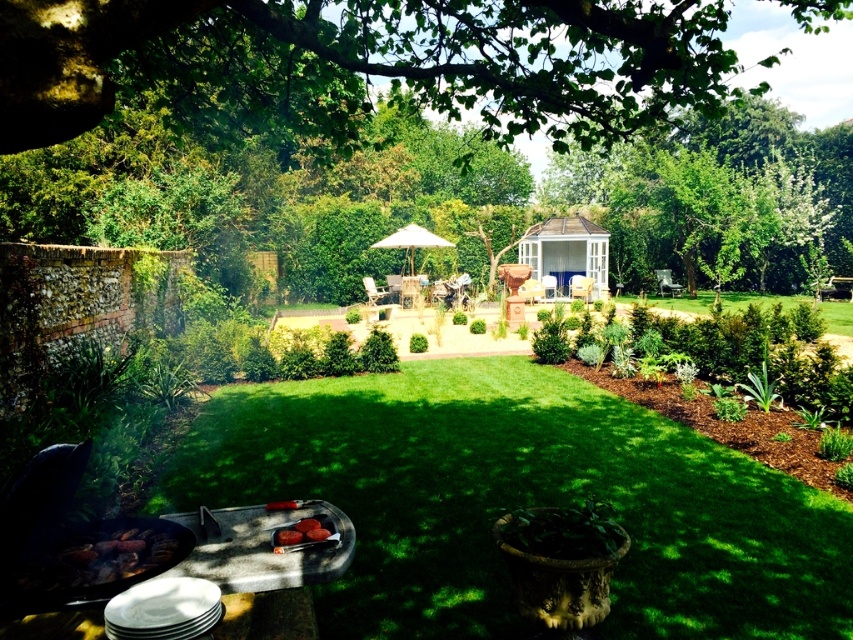
Question: Estimate the real-world distances between objects in this image. Which object is farther from the white wooden gazebo at center?

Choices:
 (A) charcoal briquettes at lower left
 (B) smooth red tomato at lower center

Answer: (A)

Question: Is smooth metal grill at lower left closer to the viewer compared to white fabric umbrella at center?

Choices:
 (A) yes
 (B) no

Answer: (A)

Question: Estimate the real-world distances between objects in this image. Which object is closer to the white wooden gazebo at center?

Choices:
 (A) wooden chair at center
 (B) green leafy tree at upper center
 (C) smooth red tomato at lower center
 (D) charcoal briquettes at lower left

Answer: (A)

Question: Estimate the real-world distances between objects in this image. Which object is farther from the smooth red tomato at lower center?

Choices:
 (A) green leafy tree at upper center
 (B) smooth metal grill at lower left
 (C) green grass at center

Answer: (A)

Question: Is smooth metal grill at lower left positioned before charcoal briquettes at lower left?

Choices:
 (A) no
 (B) yes

Answer: (B)

Question: Can you confirm if white wooden gazebo at center is bigger than white fabric umbrella at center?

Choices:
 (A) yes
 (B) no

Answer: (A)